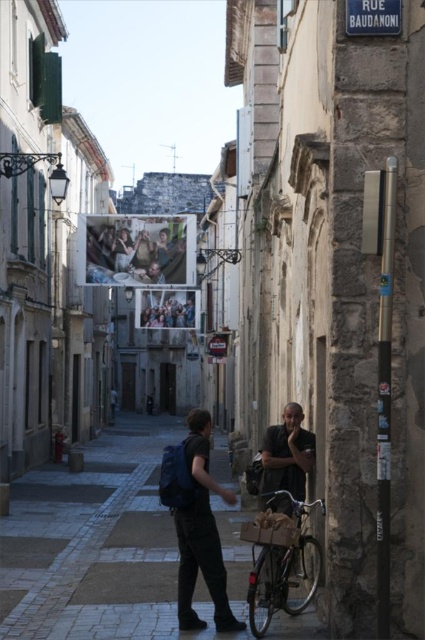
You are a delivery person who needs to retrieve your items from the scene. You see the matte blue backpack at center and the dark gray fabric jacket at center. Which item is positioned lower in the image?

The matte blue backpack at center is located below the dark gray fabric jacket at center, so it is positioned lower in the image.